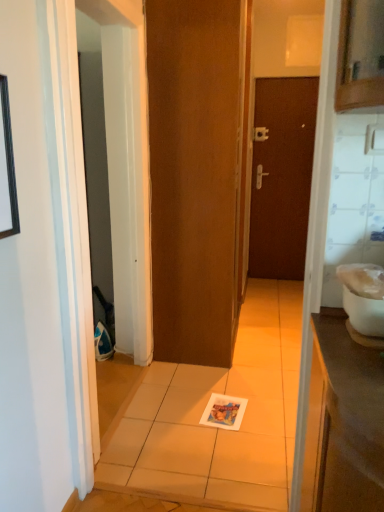
Question: From a real-world perspective, is black matte picture frame at upper left under silver metallic door handle at center?

Choices:
 (A) no
 (B) yes

Answer: (A)

Question: Is the position of black matte picture frame at upper left more distant than that of silver metallic door handle at center?

Choices:
 (A) no
 (B) yes

Answer: (A)

Question: Is black matte picture frame at upper left positioned in front of silver metallic door handle at center?

Choices:
 (A) no
 (B) yes

Answer: (B)

Question: Is black matte picture frame at upper left shorter than silver metallic door handle at center?

Choices:
 (A) no
 (B) yes

Answer: (A)

Question: Considering the relative sizes of black matte picture frame at upper left and silver metallic door handle at center in the image provided, is black matte picture frame at upper left bigger than silver metallic door handle at center?

Choices:
 (A) no
 (B) yes

Answer: (B)

Question: Considering the positions of brown matte door at center, which is the second door from right to left, and white glossy toilet bowl at right in the image, is brown matte door at center, which is the second door from right to left, wider or thinner than white glossy toilet bowl at right?

Choices:
 (A) wide
 (B) thin

Answer: (B)

Question: Does point (211, 119) appear closer or farther from the camera than point (365, 327)?

Choices:
 (A) closer
 (B) farther

Answer: (B)

Question: Relative to white glossy toilet bowl at right, is brown matte door at center, the first door positioned from the left, in front or behind?

Choices:
 (A) behind
 (B) front

Answer: (A)

Question: Looking at the image, does brown matte door at center, the 2th door viewed from the back, seem bigger or smaller compared to white glossy toilet bowl at right?

Choices:
 (A) big
 (B) small

Answer: (A)

Question: From their relative heights in the image, would you say brown matte door at center, placed as the 1th door when sorted from right to left, is taller or shorter than brown matte door at center, the 2th door viewed from the back?

Choices:
 (A) short
 (B) tall

Answer: (A)

Question: Considering the positions of brown matte door at center, placed as the 1th door when sorted from right to left, and brown matte door at center, which is the second door from right to left, in the image, is brown matte door at center, placed as the 1th door when sorted from right to left, wider or thinner than brown matte door at center, which is the second door from right to left,?

Choices:
 (A) thin
 (B) wide

Answer: (B)

Question: From a real-world perspective, is brown matte door at center, the 2th door in the front-to-back sequence, physically located above or below brown matte door at center, the first door in the front-to-back sequence?

Choices:
 (A) below
 (B) above

Answer: (A)

Question: Is brown matte door at center, placed as the 1th door when sorted from back to front, situated inside brown matte door at center, which is the second door from right to left, or outside?

Choices:
 (A) inside
 (B) outside

Answer: (B)

Question: From a real-world perspective, relative to white glossy toilet bowl at right, is brown matte door at center, arranged as the second door when viewed from the left, vertically above or below?

Choices:
 (A) below
 (B) above

Answer: (B)

Question: Relative to white glossy toilet bowl at right, is brown matte door at center, arranged as the second door when viewed from the left, in front or behind?

Choices:
 (A) front
 (B) behind

Answer: (B)